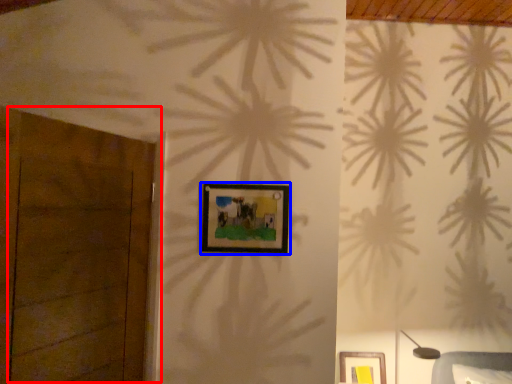
Question: Which of the following is the farthest to the observer, door (highlighted by a red box) or picture frame (highlighted by a blue box)?

Choices:
 (A) door
 (B) picture frame

Answer: (B)